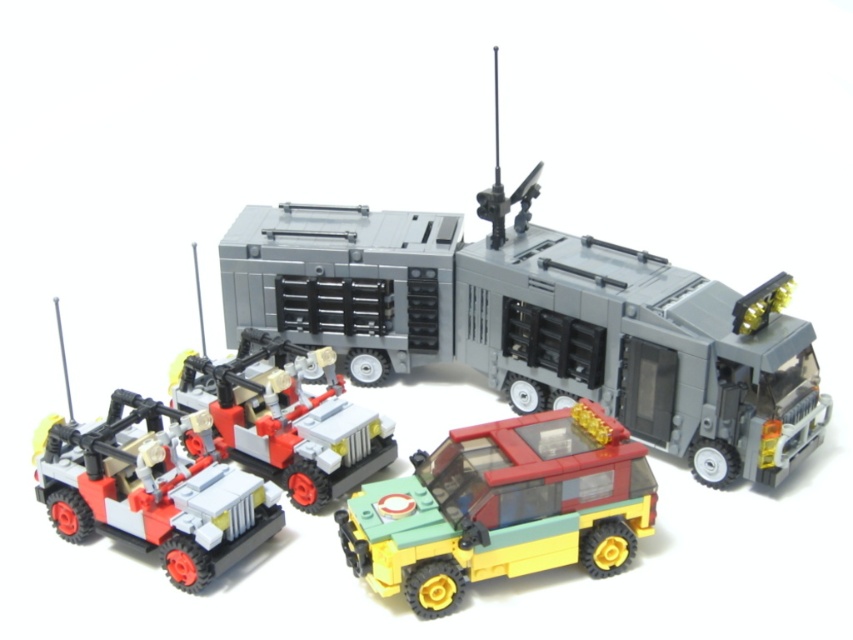
Question: Can you confirm if yellow matte car at lower center is positioned below brick-like red and white vehicle at center-left?

Choices:
 (A) yes
 (B) no

Answer: (A)

Question: Does matte gray truck at center appear on the left side of brick-like red and white vehicle at center-left?

Choices:
 (A) no
 (B) yes

Answer: (A)

Question: Among these objects, which one is farthest from the camera?

Choices:
 (A) yellow matte car at lower center
 (B) matte red and white vehicle at lower left
 (C) brick-like red and white vehicle at center-left
 (D) matte gray truck at center

Answer: (C)

Question: From the image, what is the correct spatial relationship of yellow matte car at lower center in relation to brick-like red and white vehicle at center-left?

Choices:
 (A) below
 (B) above

Answer: (A)

Question: Estimate the real-world distances between objects in this image. Which object is farther from the yellow matte car at lower center?

Choices:
 (A) matte red and white vehicle at lower left
 (B) matte gray truck at center
 (C) brick-like red and white vehicle at center-left

Answer: (B)

Question: Which of the following is the farthest from the observer?

Choices:
 (A) (585, 461)
 (B) (552, 259)

Answer: (B)